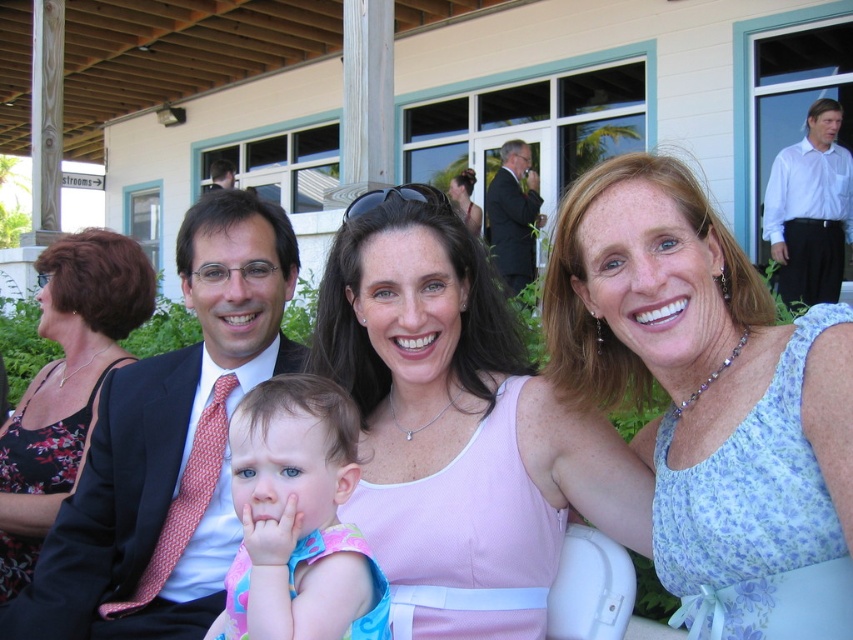
Is pink fabric dress at center smaller than black floral dress at left?

Correct, pink fabric dress at center occupies less space than black floral dress at left.

Image resolution: width=853 pixels, height=640 pixels. Find the location of `pink fabric dress at center`. pink fabric dress at center is located at coordinates (457, 426).

Between point (482, 314) and point (51, 365), which one is positioned in front?

Point (482, 314)

In order to click on pink fabric dress at center in this screenshot , I will do `click(457, 426)`.

Does pink fabric dress at center come in front of matte black suit at center?

Yes, it is.

Is point (387, 381) closer to viewer compared to point (38, 556)?

Yes, point (387, 381) is in front of point (38, 556).

Which is behind, point (492, 320) or point (165, 486)?

The point (165, 486) is behind.

Where is `pink fabric dress at center`? This screenshot has height=640, width=853. pink fabric dress at center is located at coordinates (457, 426).

Does blue floral dress at center come in front of matte black suit at center?

Yes.

Which is in front, point (686, 224) or point (299, 266)?

Point (686, 224)

Does point (567, 225) lie behind point (225, 356)?

No.

The image size is (853, 640). Find the location of `blue floral dress at center`. blue floral dress at center is located at coordinates (704, 381).